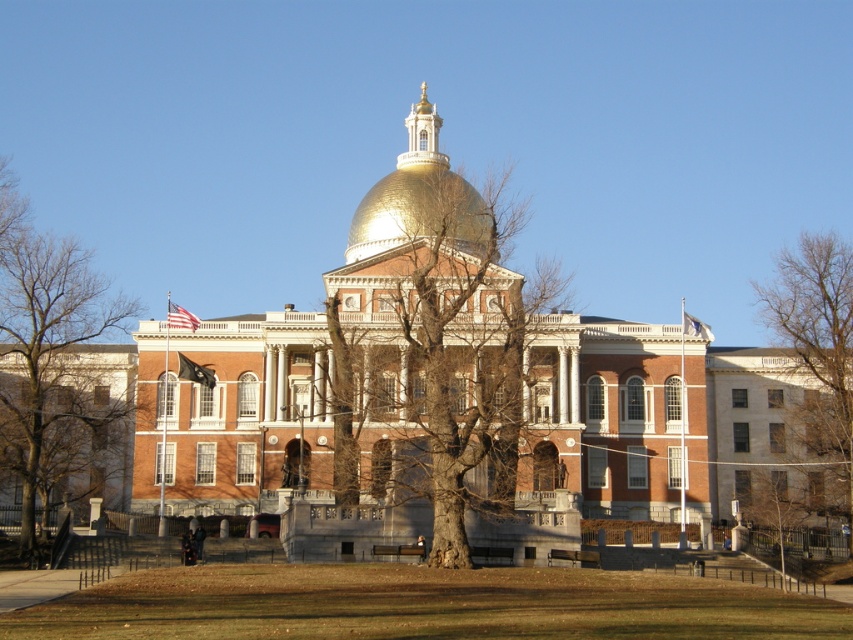
You are a landscape architect designing a pathway between the bare wood tree at left and the bare wood tree at right in front of the Massachusetts State House. Which tree should you consider for placement if you want to use the thinner trunk as a guide for the path width?

The bare wood tree at left is thinner than the bare wood tree at right, so you should use the bare wood tree at left as the guide for the path width since its trunk is narrower.

You are a landscape architect planning to plant new trees in front of the Massachusetts State House. You observe the existing bare wood tree at left and the bare wood tree at right. Which tree should you consider as a reference for height if you want to plant a tree that will grow to a similar height as the taller one?

The bare wood tree at left is much taller than the bare wood tree at right, so you should use the bare wood tree at left as a reference for height.

You are standing in front of the Massachusetts State House and see the bare wood tree at left and the gold polished dome at center. Which object is closer to the ground?

The bare wood tree at left is closer to the ground because it is positioned below the gold polished dome at center.